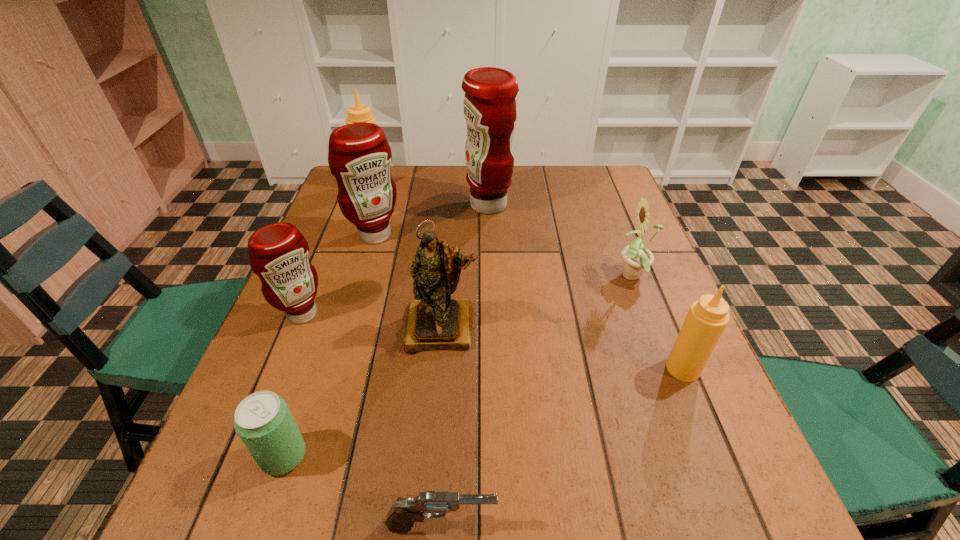
This screenshot has width=960, height=540. In order to click on sunflower situated at the right edge in this screenshot , I will do `click(637, 259)`.

Identify the location of object present at the far left corner. The width and height of the screenshot is (960, 540). (359, 113).

Find the location of a particular element. This screenshot has height=540, width=960. vacant region at the far edge of the desktop is located at coordinates (517, 193).

Where is `vacant region at the left edge of the desktop`? The height and width of the screenshot is (540, 960). vacant region at the left edge of the desktop is located at coordinates pos(328,343).

Identify the location of vacant region at the right edge of the desktop. pyautogui.click(x=637, y=308).

Locate an element on the screen. blank space at the far right corner of the desktop is located at coordinates coord(587,168).

Find the location of a particular element. The width and height of the screenshot is (960, 540). free spot between the farther tan condiment and the second nearest condiment is located at coordinates (337, 249).

I want to click on free area in between the smallest red condiment and the gold figurine, so click(x=372, y=321).

Locate an element on the screen. free space between the bigger tan condiment and the soda is located at coordinates (328, 320).

Find the location of `vacant area between the sunflower and the second condiment from right to left`. vacant area between the sunflower and the second condiment from right to left is located at coordinates (562, 241).